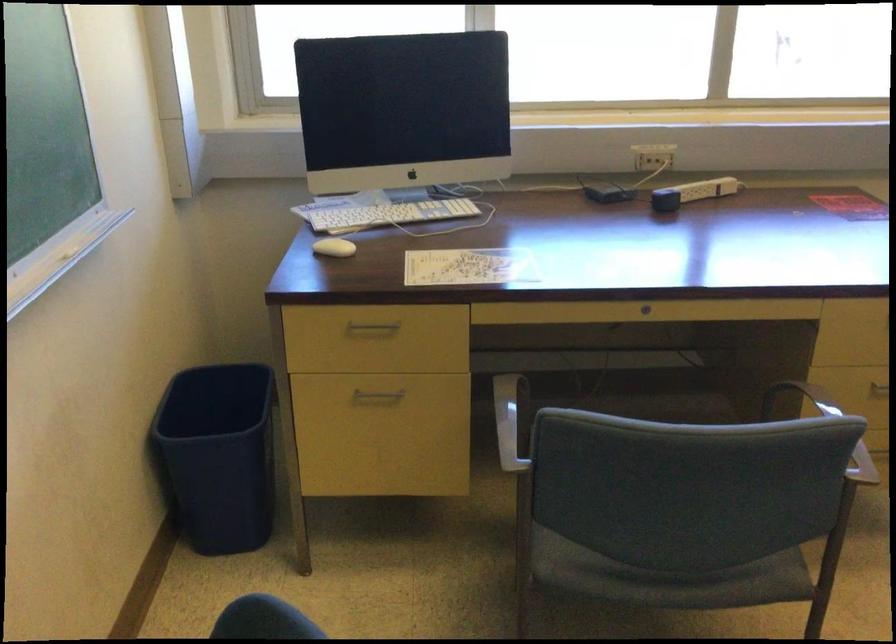
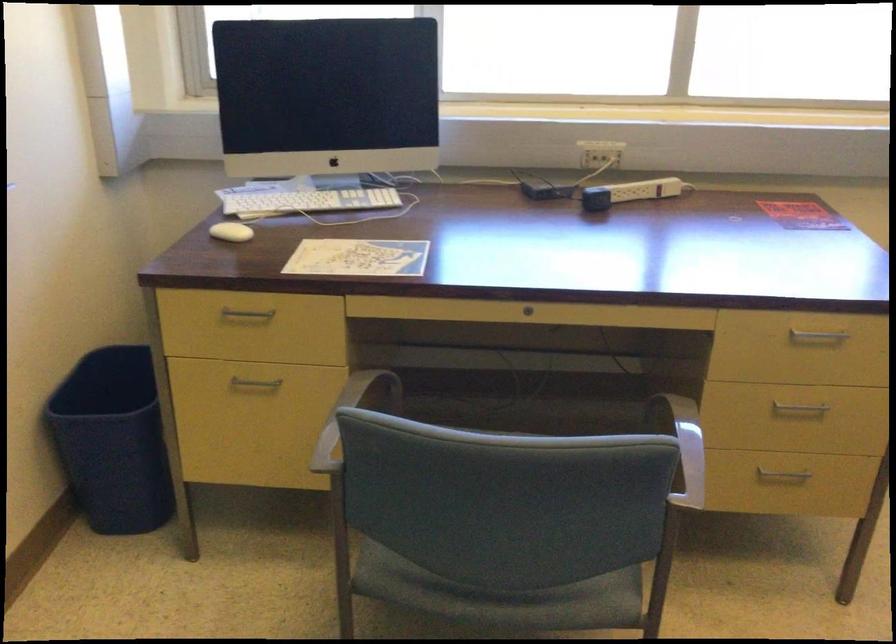
Find the pixel in the second image that matches (x=219, y=459) in the first image.

(113, 440)